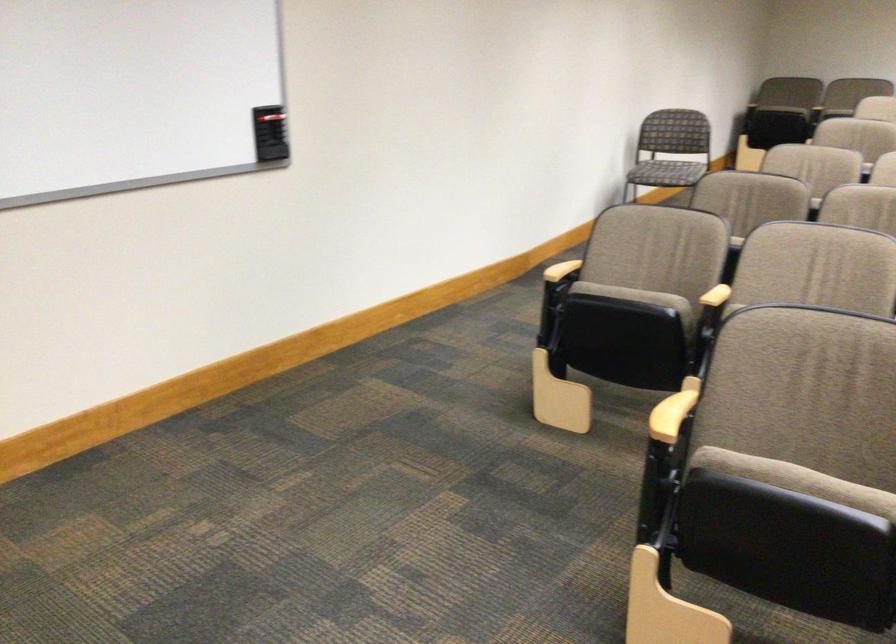
At what (x,y) coordinates should I click in order to perform the action: click on black control panel. Please return your answer as a coordinate pair (x, y). Image resolution: width=896 pixels, height=644 pixels. Looking at the image, I should click on (270, 133).